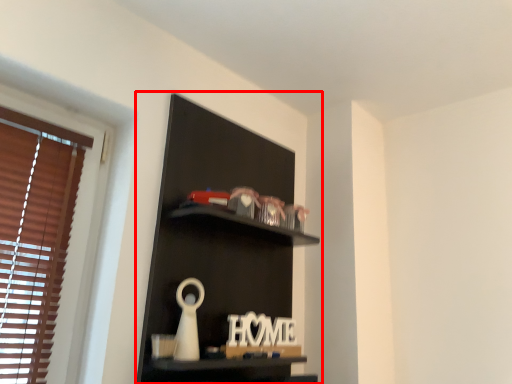
Question: From the image's perspective, what is the correct spatial relationship of shelf (annotated by the red box) in relation to letter?

Choices:
 (A) above
 (B) below

Answer: (A)